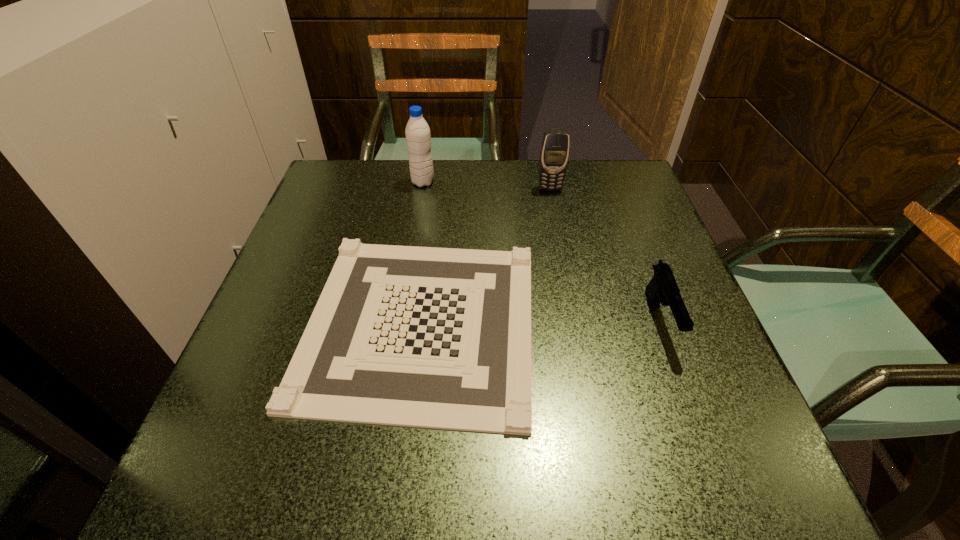
What are the coordinates of `the tallest object` in the screenshot? It's located at (418, 138).

You are a GUI agent. You are given a task and a screenshot of the screen. Output one action in this format:
    pyautogui.click(x=<x>, y=<y>)
    Task: Click on the cellular telephone
    Image resolution: width=960 pixels, height=540 pixels.
    Given the screenshot: What is the action you would take?
    pyautogui.click(x=554, y=154)

At what (x,y) coordinates should I click in order to perform the action: click on the third object from left to right. Please return your answer as a coordinate pair (x, y). The image size is (960, 540). Looking at the image, I should click on (554, 154).

This screenshot has width=960, height=540. I want to click on the third tallest object, so click(x=662, y=288).

Where is `the rightmost object`? The height and width of the screenshot is (540, 960). the rightmost object is located at coordinates (662, 288).

What are the coordinates of `checkerboard` in the screenshot? It's located at (428, 337).

Find the location of a particular element. The height and width of the screenshot is (540, 960). vacant region located on the front of the water bottle is located at coordinates (413, 242).

Locate an element on the screen. This screenshot has width=960, height=540. vacant space located on the front face of the third object from left to right is located at coordinates (554, 206).

The height and width of the screenshot is (540, 960). In order to click on vacant space situated 0.130m on the front-facing side of the pistol in this screenshot , I will do `click(700, 429)`.

Find the location of a particular element. free space located 0.300m on the right of the checkerboard is located at coordinates (700, 322).